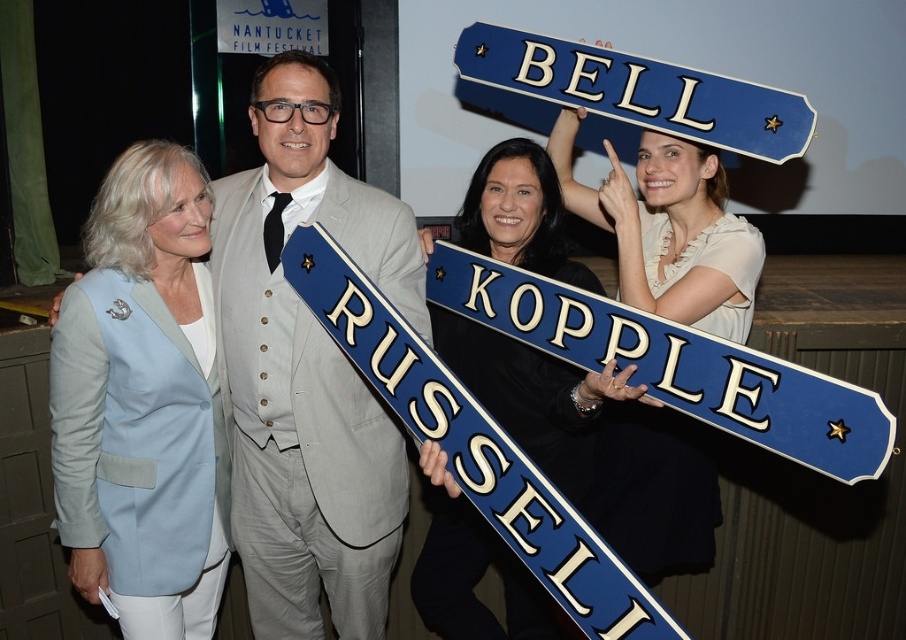
You are a photographer at the event and need to frame a photo that includes both the white satin dress at upper center and the blue metallic street sign at center. Which object should you adjust your camera to focus on first if you want to ensure both are in the frame without cropping?

The white satin dress at upper center has a smaller width compared to the blue metallic street sign at center. To include both in the frame without cropping, focus on the wider blue metallic street sign at center first, then adjust to ensure the narrower white satin dress at upper center is also visible.